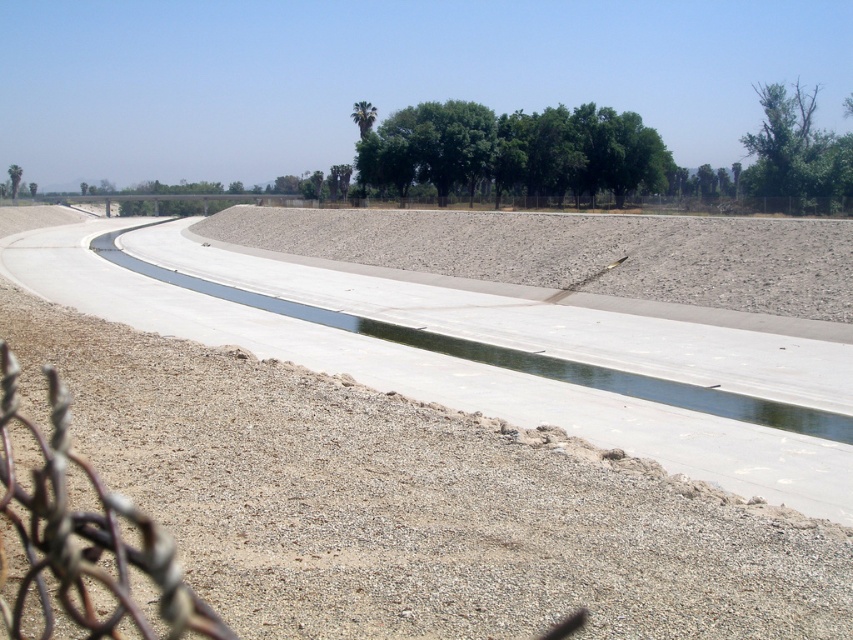
You are standing at the center of the canal and want to locate the green leafy tree at upper right. In which direction should you look to see it?

The green leafy tree at upper right is located at coordinates 0.233 on the x axis and 0.933 on the y axis, which places it in the upper right direction from your current position at the center of the canal.

You are standing at the barbed wire fence near the canal and want to determine the distance between the two points marked in the image. Which point is closer to you, point 1 at coordinates point (22, 372) or point 2 at coordinates point (405, 173)?

Point 1 at coordinates point (22, 372) is closer to you than point 2 at coordinates point (405, 173).

You are a surveyor measuring the elevation of the gray gravel dirt field at center and the green leafy trees at center in the image. Which one has a higher elevation?

The green leafy trees at center have a higher elevation than the gray gravel dirt field at center.